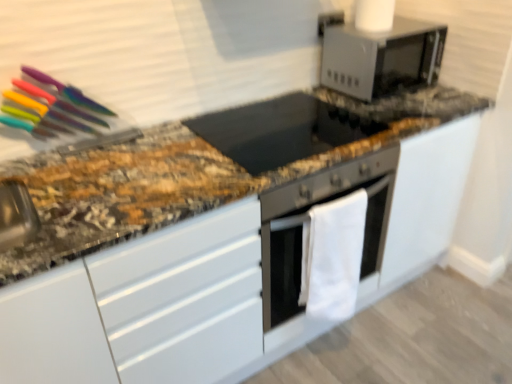
Measure the distance between white fabric oven at center and camera.

The distance of white fabric oven at center from camera is 1.36 meters.

The width and height of the screenshot is (512, 384). What do you see at coordinates (380, 57) in the screenshot?
I see `satin silver microwave at upper right` at bounding box center [380, 57].

Locate an element on the screen. The height and width of the screenshot is (384, 512). black glass cooktop at center is located at coordinates (279, 131).

Would you consider black glass cooktop at center to be distant from white fabric oven at center?

They are positioned close to each other.

Between black glass cooktop at center and white fabric oven at center, which one has larger width?

black glass cooktop at center.

At what (x,y) coordinates should I click in order to perform the action: click on appliance located in front of the white fabric oven at center. Please return your answer as a coordinate pair (x, y). Looking at the image, I should click on (279, 131).

From the image's perspective, which one is positioned higher, satin silver microwave at upper right or black glass cooktop at center?

satin silver microwave at upper right appears higher in the image.

Is satin silver microwave at upper right oriented towards black glass cooktop at center?

No, satin silver microwave at upper right is not oriented towards black glass cooktop at center.

From a real-world perspective, is satin silver microwave at upper right positioned above or below black glass cooktop at center?

Clearly, from a real-world perspective, satin silver microwave at upper right is above black glass cooktop at center.

From a real-world perspective, is white fabric oven at center on top of satin silver microwave at upper right?

No, from a real-world perspective, white fabric oven at center is not above satin silver microwave at upper right.

Does white fabric oven at center appear on the right side of satin silver microwave at upper right?

No.

Considering the positions of points (289, 280) and (336, 38), is point (289, 280) closer to camera compared to point (336, 38)?

Yes, it is in front of point (336, 38).

Does satin silver microwave at upper right touch white fabric oven at center?

No, satin silver microwave at upper right is not making contact with white fabric oven at center.

Is point (439, 56) farther from camera compared to point (264, 325)?

Yes, it is.

How different are the orientations of satin silver microwave at upper right and white fabric oven at center in degrees?

There is a 0.345-degree angle between the facing directions of satin silver microwave at upper right and white fabric oven at center.

Considering the relative sizes of satin silver microwave at upper right and white fabric oven at center in the image provided, is satin silver microwave at upper right wider than white fabric oven at center?

Correct, the width of satin silver microwave at upper right exceeds that of white fabric oven at center.

Can you confirm if white fabric oven at center is thinner than black glass cooktop at center?

Yes.

Between white fabric oven at center and black glass cooktop at center, which one is positioned in front?

black glass cooktop at center is closer to the camera.

Is black glass cooktop at center completely or partially inside white fabric oven at center?

That's incorrect, black glass cooktop at center is not inside white fabric oven at center.

Does point (289, 306) come farther from viewer compared to point (269, 104)?

That is False.

Looking at this image, considering the sizes of objects black glass cooktop at center and satin silver microwave at upper right in the image provided, who is smaller, black glass cooktop at center or satin silver microwave at upper right?

black glass cooktop at center is smaller.

Consider the image. Is black glass cooktop at center taller than satin silver microwave at upper right?

In fact, black glass cooktop at center may be shorter than satin silver microwave at upper right.

Would you say black glass cooktop at center is a long distance from satin silver microwave at upper right?

No.

Is satin silver microwave at upper right surrounded by black glass cooktop at center?

Actually, satin silver microwave at upper right is outside black glass cooktop at center.

Find the location of a particular element. This screenshot has height=384, width=512. oven located on the right of black glass cooktop at center is located at coordinates point(282,273).

Find the location of a particular element. This screenshot has width=512, height=384. appliance in front of the satin silver microwave at upper right is located at coordinates (279, 131).

Which object lies nearer to the anchor point satin silver microwave at upper right, white fabric oven at center or black glass cooktop at center?

black glass cooktop at center.

When comparing their distances from black glass cooktop at center, does white fabric oven at center or satin silver microwave at upper right seem closer?

satin silver microwave at upper right.

From the picture: Looking at the image, which one is located further to black glass cooktop at center, satin silver microwave at upper right or white fabric oven at center?

Based on the image, white fabric oven at center appears to be further to black glass cooktop at center.

Based on their spatial positions, is black glass cooktop at center or white fabric oven at center further from satin silver microwave at upper right?

white fabric oven at center is further to satin silver microwave at upper right.

Looking at the image, which one is located closer to white fabric oven at center, satin silver microwave at upper right or black glass cooktop at center?

black glass cooktop at center.

Based on their spatial positions, is black glass cooktop at center or satin silver microwave at upper right closer to white fabric oven at center?

black glass cooktop at center is positioned closer to the anchor white fabric oven at center.

The height and width of the screenshot is (384, 512). In order to click on appliance between satin silver microwave at upper right and white fabric oven at center from top to bottom in this screenshot , I will do `click(279, 131)`.